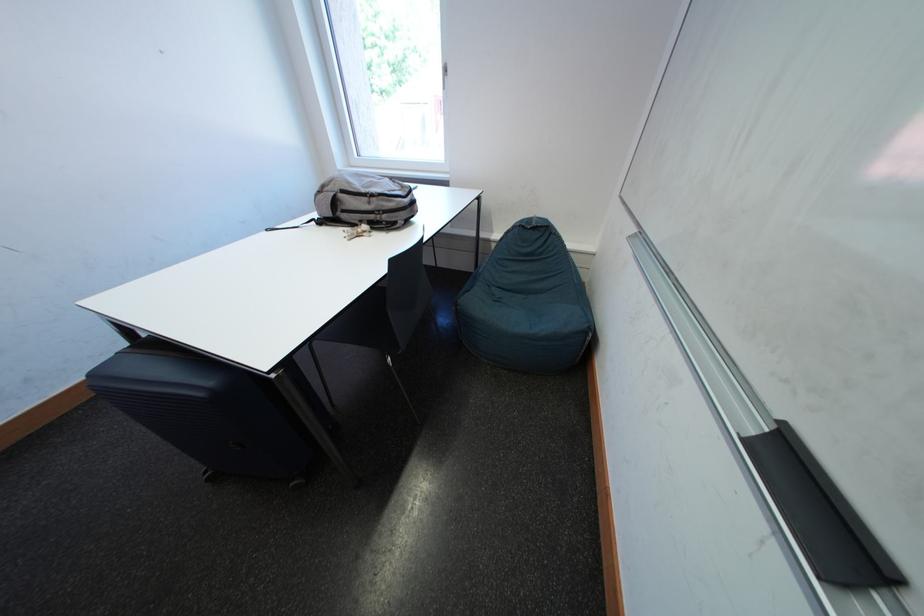
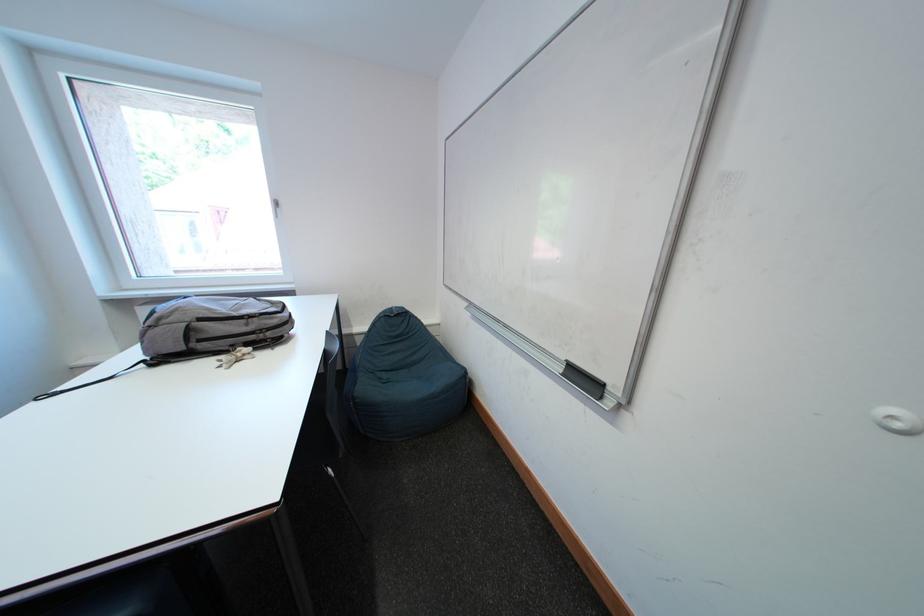
Locate, in the second image, the point that corresponds to point 507,296 in the first image.

(394, 379)